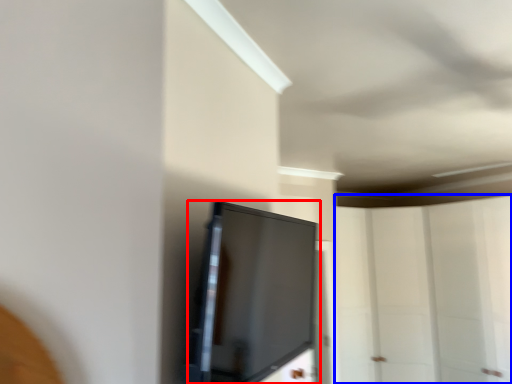
Question: Which point is further to the camera, screen (highlighted by a red box) or glass door (highlighted by a blue box)?

Choices:
 (A) screen
 (B) glass door

Answer: (B)